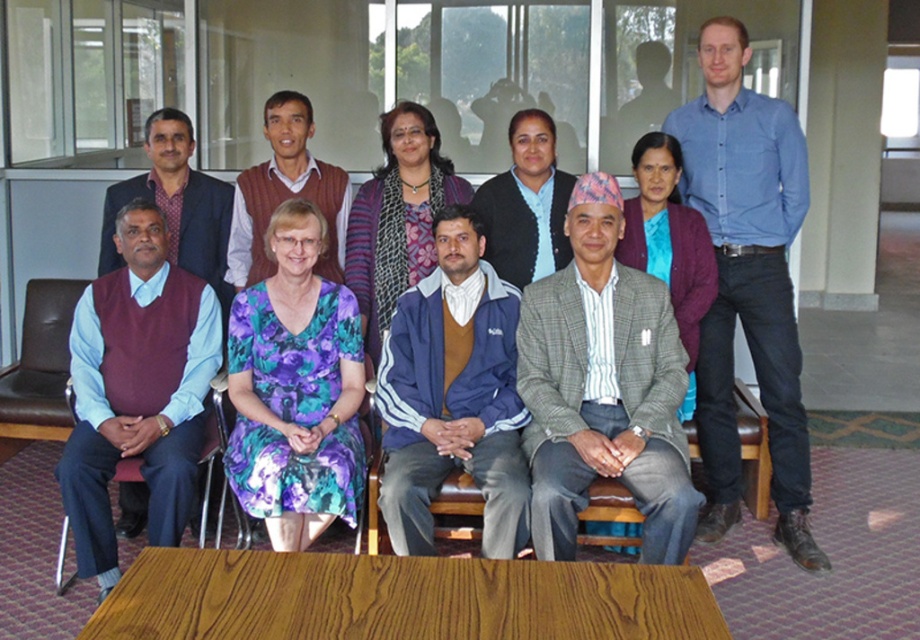
You are taking a photo of the group and want to focus on two specific points in the image, point [312,538] and point [382,301]. Which point is closer to the camera?

Point [312,538] is closer to the camera than point [382,301].

You are a photographer positioned at the entrance of the room. You need to take a photo of both the blue fabric jacket at center and the brown leather chair at lower left. Which object will appear larger in your photo?

The blue fabric jacket at center will appear larger in the photo because it is closer to the viewer than the brown leather chair at lower left.